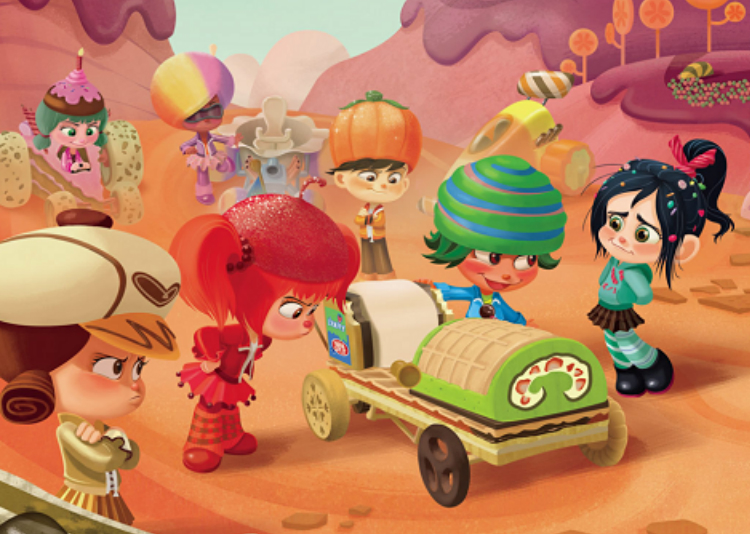
You are a GUI agent. You are given a task and a screenshot of the screen. Output one action in this format:
    pyautogui.click(x=<x>, y=<y>)
    Task: Click on the seat
    
    Given the screenshot: What is the action you would take?
    pyautogui.click(x=402, y=340)